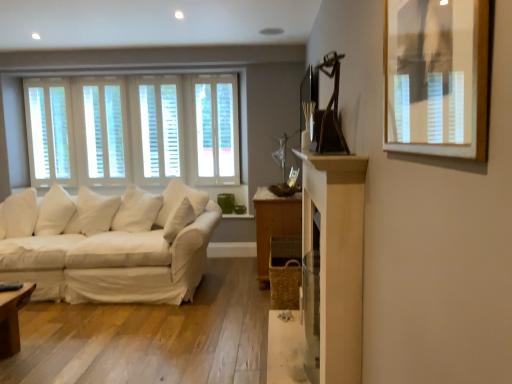
Question: Could you tell me if white wood blinds at left, the first window in the left-to-right sequence, is facing white wood window at center, which is counted as the 1th window, starting from the right?

Choices:
 (A) no
 (B) yes

Answer: (A)

Question: Can you confirm if white wood blinds at left, the first window in the left-to-right sequence, is shorter than white wood window at center, which is the 2th window from left to right?

Choices:
 (A) no
 (B) yes

Answer: (B)

Question: Are white wood blinds at left, arranged as the 2th window when viewed from the right, and white wood window at center, which is the 2th window from left to right, making contact?

Choices:
 (A) yes
 (B) no

Answer: (B)

Question: Does white wood blinds at left, the first window in the left-to-right sequence, have a lesser width compared to white wood window at center, which is counted as the 1th window, starting from the right?

Choices:
 (A) no
 (B) yes

Answer: (B)

Question: From a real-world perspective, is white wood blinds at left, arranged as the 2th window when viewed from the right, on white wood window at center, which is the 2th window from left to right?

Choices:
 (A) yes
 (B) no

Answer: (B)

Question: Looking at the image, does white wood window at center, which is the 2th window from left to right, seem bigger or smaller compared to white fabric couch at left?

Choices:
 (A) small
 (B) big

Answer: (A)

Question: Considering the positions of white wood window at center, which is counted as the 1th window, starting from the right, and white fabric couch at left in the image, is white wood window at center, which is counted as the 1th window, starting from the right, taller or shorter than white fabric couch at left?

Choices:
 (A) short
 (B) tall

Answer: (B)

Question: Choose the correct answer: Is white wood window at center, which is counted as the 1th window, starting from the right, inside white fabric couch at left or outside it?

Choices:
 (A) outside
 (B) inside

Answer: (A)

Question: Looking at their shapes, would you say white wood window at center, which is the 2th window from left to right, is wider or thinner than white fabric couch at left?

Choices:
 (A) wide
 (B) thin

Answer: (B)

Question: From the image's perspective, is wooden dresser at center positioned above or below white wood window at center, which is counted as the 1th window, starting from the right?

Choices:
 (A) below
 (B) above

Answer: (A)

Question: Is point (266, 284) closer or farther from the camera than point (216, 84)?

Choices:
 (A) farther
 (B) closer

Answer: (B)

Question: Considering the relative positions of wooden dresser at center and white wood window at center, which is the 2th window from left to right, in the image provided, is wooden dresser at center to the left or to the right of white wood window at center, which is the 2th window from left to right,?

Choices:
 (A) right
 (B) left

Answer: (A)

Question: Do you think wooden dresser at center is within white wood window at center, which is counted as the 1th window, starting from the right, or outside of it?

Choices:
 (A) inside
 (B) outside

Answer: (B)

Question: Is white fabric couch at left in front of or behind white wood window at center, which is counted as the 1th window, starting from the right, in the image?

Choices:
 (A) behind
 (B) front

Answer: (B)

Question: Does point (48, 215) appear closer or farther from the camera than point (224, 115)?

Choices:
 (A) closer
 (B) farther

Answer: (A)